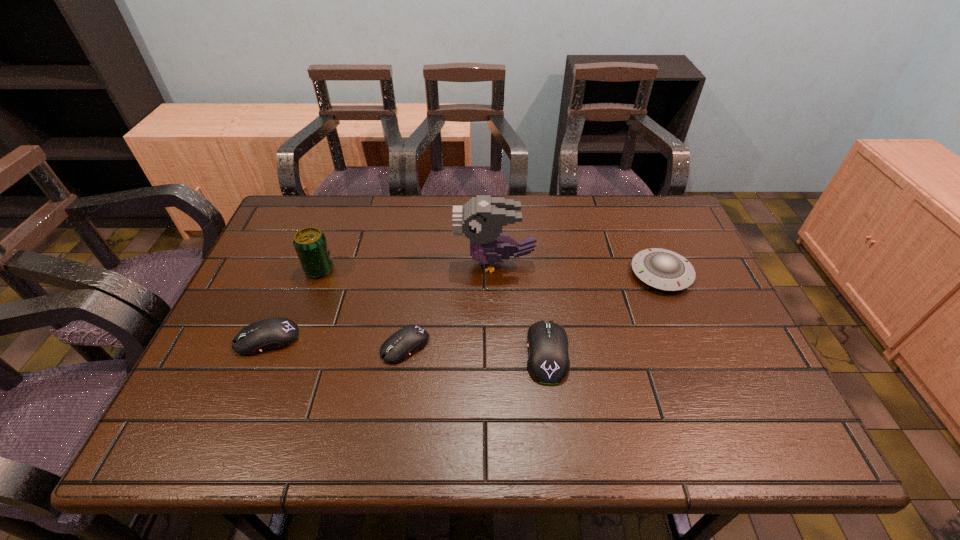
Find the location of a particular element. The height and width of the screenshot is (540, 960). free location located 0.060m on the back of the saucer is located at coordinates (647, 240).

Where is `vacant area situated at the beak of the bird`? vacant area situated at the beak of the bird is located at coordinates 336,263.

You are a GUI agent. You are given a task and a screenshot of the screen. Output one action in this format:
    pyautogui.click(x=<x>, y=<y>)
    Task: Click on the vacant space situated 0.290m at the beak of the bird
    The image size is (960, 540).
    Given the screenshot: What is the action you would take?
    pyautogui.click(x=353, y=263)

Identify the location of vacant area situated 0.110m at the beak of the bird. The width and height of the screenshot is (960, 540). (417, 263).

Identify the location of vacant space located 0.200m on the back of the fifth shortest object. (339, 217).

Image resolution: width=960 pixels, height=540 pixels. Find the location of `object that is at the near edge`. object that is at the near edge is located at coordinates (548, 362).

I want to click on computer equipment that is at the left edge, so click(x=276, y=333).

What are the coordinates of `beer can situated at the left edge` in the screenshot? It's located at [x=310, y=243].

In order to click on object positioned at the right edge in this screenshot , I will do `click(663, 269)`.

The height and width of the screenshot is (540, 960). In the image, there is a desktop. Find the location of `vacant region at the far edge`. vacant region at the far edge is located at coordinates (347, 215).